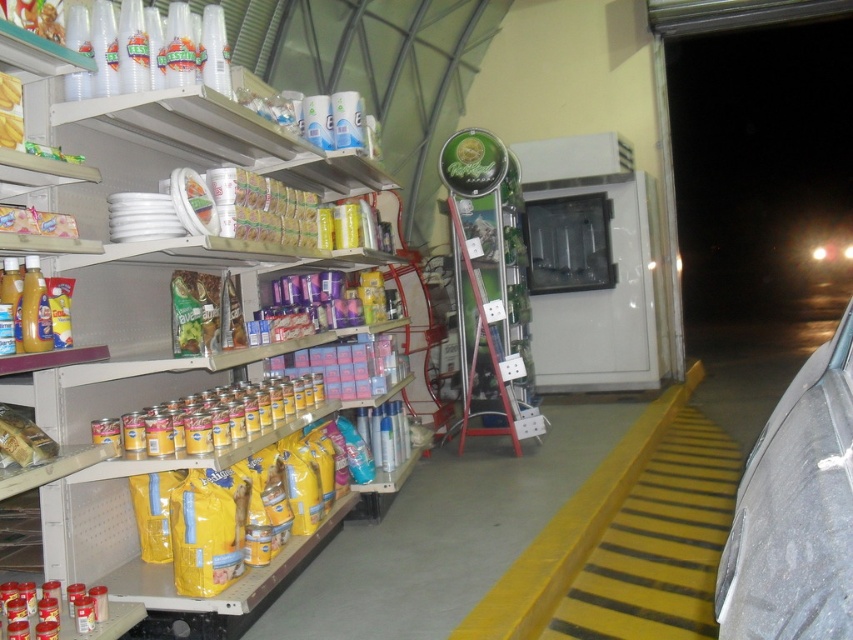
Which is more to the right, yellow rubber mat at lower right or matte gold foil at shelf left?

yellow rubber mat at lower right is more to the right.

Describe the element at coordinates (659, 536) in the screenshot. The width and height of the screenshot is (853, 640). I see `yellow rubber mat at lower right` at that location.

At what (x,y) coordinates should I click in order to perform the action: click on yellow rubber mat at lower right. Please return your answer as a coordinate pair (x, y). Looking at the image, I should click on (659, 536).

Is yellow matte plastic bags at lower left closer to camera compared to yellow rubber mat at lower right?

Yes, it is in front of yellow rubber mat at lower right.

Which is in front, point (70, 536) or point (676, 531)?

Positioned in front is point (70, 536).

I want to click on yellow matte plastic bags at lower left, so click(x=173, y=250).

Which is behind, point (140, 353) or point (35, 448)?

The point (140, 353) is more distant.

Who is more distant from viewer, (85, 577) or (30, 454)?

The point (85, 577) is more distant.

Locate an element on the screen. The image size is (853, 640). yellow matte plastic bags at lower left is located at coordinates (173, 250).